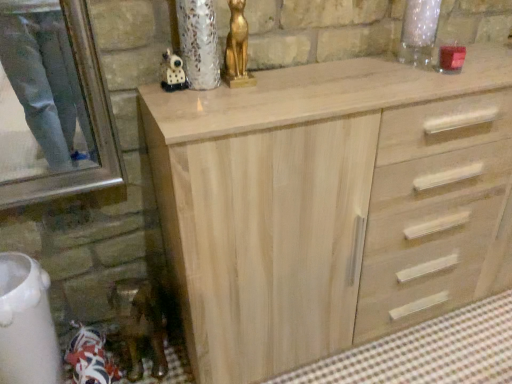
Question: Is matte black figurine at upper center, which ranks as the 2th miniature in left-to-right order, facing away from natural wood cabinet at center?

Choices:
 (A) yes
 (B) no

Answer: (B)

Question: Is matte black figurine at upper center, which ranks as the 2th miniature in left-to-right order, surrounding natural wood cabinet at center?

Choices:
 (A) no
 (B) yes

Answer: (A)

Question: Does matte black figurine at upper center, positioned as the 1th miniature in right-to-left order, have a smaller size compared to natural wood cabinet at center?

Choices:
 (A) no
 (B) yes

Answer: (B)

Question: Is matte black figurine at upper center, arranged as the 1th miniature when viewed from the top, beside natural wood cabinet at center?

Choices:
 (A) no
 (B) yes

Answer: (A)

Question: From the image's perspective, is matte black figurine at upper center, positioned as the 1th miniature in right-to-left order, on top of natural wood cabinet at center?

Choices:
 (A) no
 (B) yes

Answer: (B)

Question: Is gold metallic cat statue at upper center bigger or smaller than metallic gold figurine at lower left, the second miniature positioned from the right?

Choices:
 (A) big
 (B) small

Answer: (B)

Question: Considering the relative positions of gold metallic cat statue at upper center and metallic gold figurine at lower left, which ranks as the first miniature in back-to-front order, in the image provided, is gold metallic cat statue at upper center to the left or to the right of metallic gold figurine at lower left, which ranks as the first miniature in back-to-front order,?

Choices:
 (A) right
 (B) left

Answer: (A)

Question: Is gold metallic cat statue at upper center inside or outside of metallic gold figurine at lower left, positioned as the 2th miniature in front-to-back order?

Choices:
 (A) inside
 (B) outside

Answer: (B)

Question: Is point (230, 56) closer or farther from the camera than point (113, 299)?

Choices:
 (A) closer
 (B) farther

Answer: (A)

Question: Based on their sizes in the image, would you say gold metallic cat statue at upper center is bigger or smaller than natural wood cabinet at center?

Choices:
 (A) small
 (B) big

Answer: (A)

Question: In terms of height, does gold metallic cat statue at upper center look taller or shorter compared to natural wood cabinet at center?

Choices:
 (A) short
 (B) tall

Answer: (A)

Question: Considering their positions, is gold metallic cat statue at upper center located in front of or behind natural wood cabinet at center?

Choices:
 (A) front
 (B) behind

Answer: (B)

Question: From the image's perspective, is gold metallic cat statue at upper center located above or below natural wood cabinet at center?

Choices:
 (A) below
 (B) above

Answer: (B)

Question: Considering the positions of natural wood cabinet at center and matte black figurine at upper center, which is the 2th miniature in back-to-front order, in the image, is natural wood cabinet at center bigger or smaller than matte black figurine at upper center, which is the 2th miniature in back-to-front order,?

Choices:
 (A) small
 (B) big

Answer: (B)

Question: In terms of height, does natural wood cabinet at center look taller or shorter compared to matte black figurine at upper center, which is the 2th miniature in back-to-front order?

Choices:
 (A) tall
 (B) short

Answer: (A)